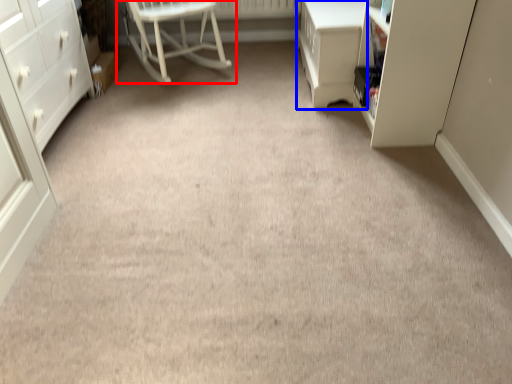
Question: Which of the following is the farthest to the observer, chair (highlighted by a red box) or vanity (highlighted by a blue box)?

Choices:
 (A) chair
 (B) vanity

Answer: (A)